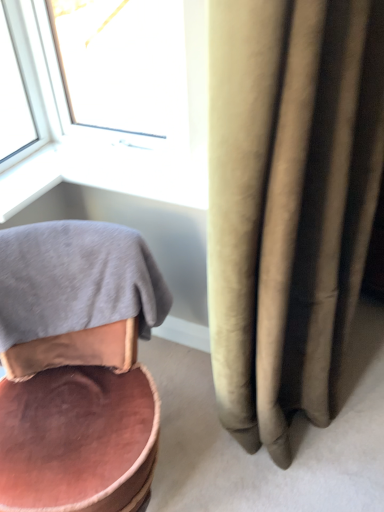
Measure the distance between point (63,228) and camera.

They are 4.08 feet apart.

What do you see at coordinates (76, 280) in the screenshot?
I see `gray cotton bath towel at lower left` at bounding box center [76, 280].

In order to face pink velvet chair at lower left, should I rotate leftwards or rightwards?

You should rotate left by 16.294 degrees.

This screenshot has width=384, height=512. What are the coordinates of `gray cotton bath towel at lower left` in the screenshot? It's located at (76, 280).

Is white plastic window at upper left in contact with pink velvet chair at lower left?

No.

Is white plastic window at upper left located outside pink velvet chair at lower left?

Yes, white plastic window at upper left is located beyond the bounds of pink velvet chair at lower left.

Is white plastic window at upper left wider than pink velvet chair at lower left?

Incorrect, the width of white plastic window at upper left does not surpass that of pink velvet chair at lower left.

Is white plastic window at upper left positioned in front of pink velvet chair at lower left?

No.

From the image's perspective, does pink velvet chair at lower left appear lower than gray cotton bath towel at lower left?

Correct, pink velvet chair at lower left appears lower than gray cotton bath towel at lower left in the image.

Is point (47, 390) positioned before point (139, 333)?

Yes, point (47, 390) is in front of point (139, 333).

Between pink velvet chair at lower left and gray cotton bath towel at lower left, which one appears on the left side from the viewer's perspective?

Positioned to the left is gray cotton bath towel at lower left.

From the image's perspective, between white plastic window at upper left and gray cotton bath towel at lower left, which one is located above?

white plastic window at upper left.

Can you tell me how much white plastic window at upper left and gray cotton bath towel at lower left differ in facing direction?

The angular difference between white plastic window at upper left and gray cotton bath towel at lower left is 30.6 degrees.

Does point (171, 40) lie behind point (109, 306)?

No, (171, 40) is closer to viewer.

Which of these two, white plastic window at upper left or gray cotton bath towel at lower left, is thinner?

Thinner between the two is white plastic window at upper left.

Is point (76, 312) closer or farther from the camera than point (194, 187)?

Point (76, 312) appears to be closer to the viewer than point (194, 187).

Considering the relative positions of gray cotton bath towel at lower left and white plastic window at upper left in the image provided, is gray cotton bath towel at lower left to the left of white plastic window at upper left from the viewer's perspective?

Yes.

Between gray cotton bath towel at lower left and white plastic window at upper left, which one has larger size?

gray cotton bath towel at lower left is bigger.

Is pink velvet chair at lower left not within white plastic window at upper left?

pink velvet chair at lower left is positioned outside white plastic window at upper left.

Which is behind, point (122, 452) or point (206, 169)?

Positioned behind is point (206, 169).

Is pink velvet chair at lower left in contact with white plastic window at upper left?

No, pink velvet chair at lower left is not with white plastic window at upper left.

Considering the relative sizes of gray cotton bath towel at lower left and pink velvet chair at lower left in the image provided, is gray cotton bath towel at lower left taller than pink velvet chair at lower left?

No.

From a real-world perspective, is gray cotton bath towel at lower left positioned above or below pink velvet chair at lower left?

gray cotton bath towel at lower left is situated higher than pink velvet chair at lower left in the real world.

Can you confirm if gray cotton bath towel at lower left is thinner than pink velvet chair at lower left?

Indeed, gray cotton bath towel at lower left has a lesser width compared to pink velvet chair at lower left.

How different are the orientations of gray cotton bath towel at lower left and pink velvet chair at lower left in degrees?

The angular difference between gray cotton bath towel at lower left and pink velvet chair at lower left is 0.000495 degrees.

Locate an element on the screen. Image resolution: width=384 pixels, height=512 pixels. window behind the pink velvet chair at lower left is located at coordinates point(120,130).

Where is `bath towel that is on the left side of pink velvet chair at lower left`? The height and width of the screenshot is (512, 384). bath towel that is on the left side of pink velvet chair at lower left is located at coordinates (76, 280).

In the scene shown: Which object lies further to the anchor point pink velvet chair at lower left, white plastic window at upper left or gray cotton bath towel at lower left?

white plastic window at upper left lies further to pink velvet chair at lower left than the other object.

Which object lies nearer to the anchor point gray cotton bath towel at lower left, white plastic window at upper left or pink velvet chair at lower left?

pink velvet chair at lower left.

Looking at this image, estimate the real-world distances between objects in this image. Which object is closer to white plastic window at upper left, gray cotton bath towel at lower left or pink velvet chair at lower left?

gray cotton bath towel at lower left.

From the picture: Which object lies further to the anchor point gray cotton bath towel at lower left, pink velvet chair at lower left or white plastic window at upper left?

white plastic window at upper left.

From the image, which object appears to be farther from white plastic window at upper left, pink velvet chair at lower left or gray cotton bath towel at lower left?

pink velvet chair at lower left.

Looking at this image, estimate the real-world distances between objects in this image. Which object is further from pink velvet chair at lower left, gray cotton bath towel at lower left or white plastic window at upper left?

white plastic window at upper left is further to pink velvet chair at lower left.

Image resolution: width=384 pixels, height=512 pixels. Find the location of `bath towel between white plastic window at upper left and pink velvet chair at lower left from top to bottom`. bath towel between white plastic window at upper left and pink velvet chair at lower left from top to bottom is located at coordinates (76, 280).